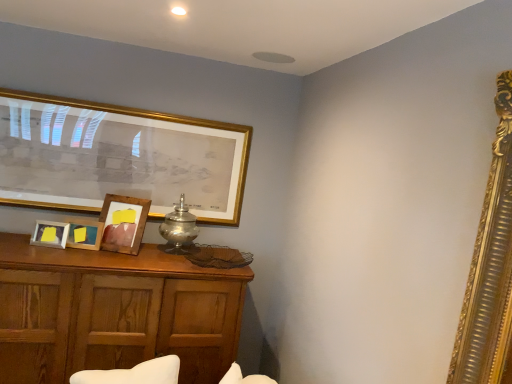
The width and height of the screenshot is (512, 384). What are the coordinates of `empty space that is ontop of gold-framed picture at upper left, the first picture frame from the back (from a real-world perspective)` in the screenshot? It's located at (126, 100).